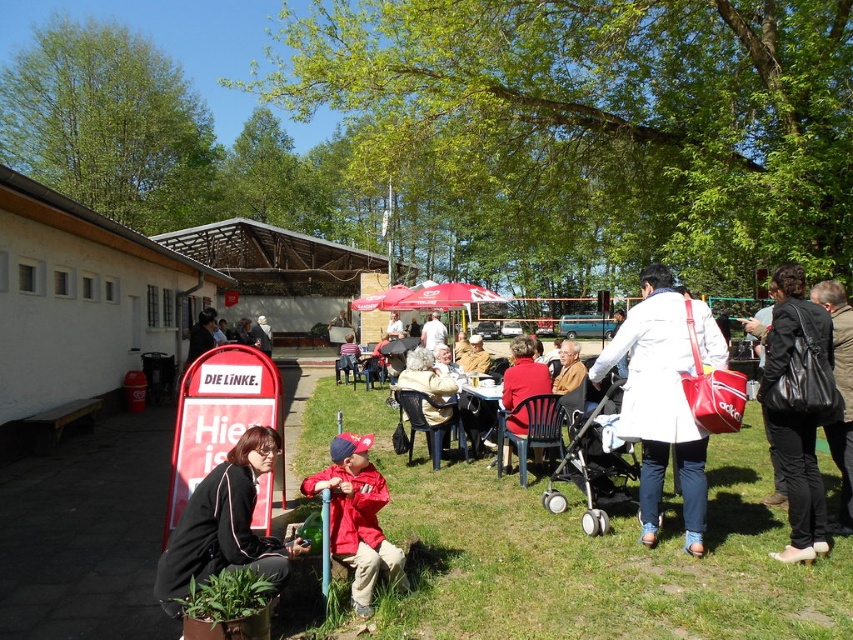
Does red matte jacket at lower center have a greater height compared to dark gray coat at center?

Indeed, red matte jacket at lower center has a greater height compared to dark gray coat at center.

Does point (386, 552) come in front of point (206, 330)?

Yes, it is in front of point (206, 330).

You are a GUI agent. You are given a task and a screenshot of the screen. Output one action in this format:
    pyautogui.click(x=<x>, y=<y>)
    Task: Click on the red matte jacket at lower center
    The image size is (853, 640).
    Given the screenshot: What is the action you would take?
    pyautogui.click(x=357, y=516)

Is red fabric coat at center smaller than red fabric umbrella at center?

Yes.

Locate an element on the screen. Image resolution: width=853 pixels, height=640 pixels. red fabric coat at center is located at coordinates (521, 381).

Based on the photo, can you confirm if white leather coat at center is positioned to the right of wooden picnic table at center?

Yes, white leather coat at center is to the right of wooden picnic table at center.

From the picture: Which is above, white leather coat at center or wooden picnic table at center?

white leather coat at center is above.

I want to click on white leather coat at center, so click(x=664, y=397).

The image size is (853, 640). In order to click on white leather coat at center in this screenshot , I will do `click(664, 397)`.